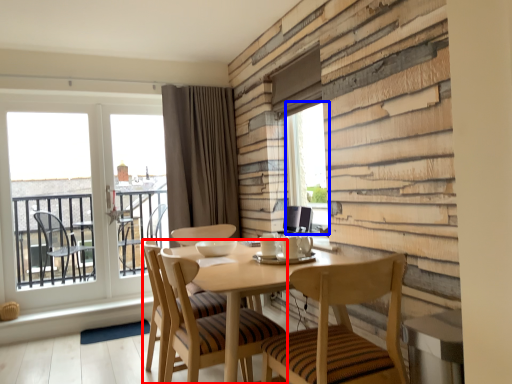
Question: Which object is closer to the camera taking this photo, chair (highlighted by a red box) or window screen (highlighted by a blue box)?

Choices:
 (A) chair
 (B) window screen

Answer: (A)